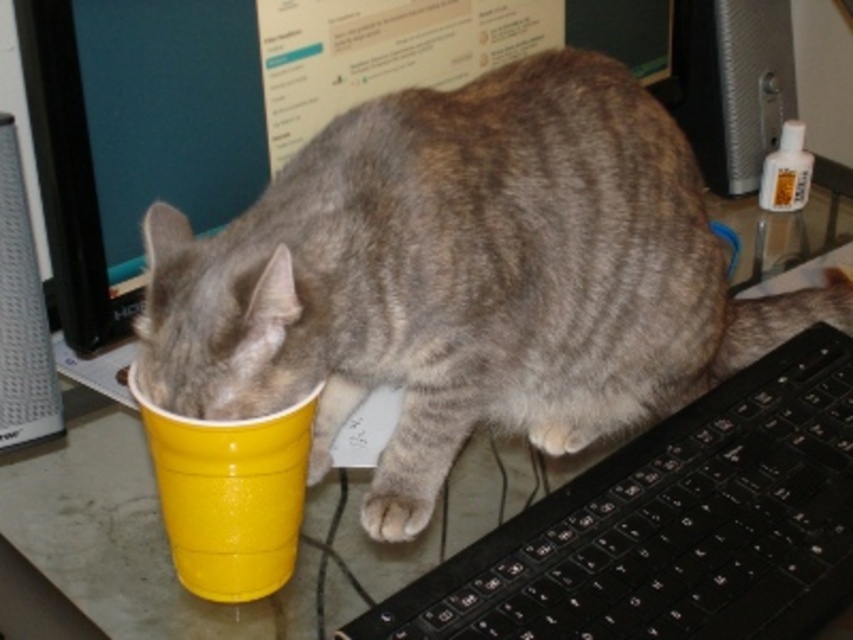
Is gray striped cat at center positioned at the back of black plastic keyboard at lower right?

No, it is not.

Identify the location of gray striped cat at center. Image resolution: width=853 pixels, height=640 pixels. (465, 273).

Is black plastic keyboard at lower right further to the viewer compared to yellow plastic cup at lower left?

Yes, black plastic keyboard at lower right is behind yellow plastic cup at lower left.

Who is more distant from viewer, [697,449] or [231,508]?

The point [697,449] is more distant.

Consider the image. Who is more distant from viewer, (695, 554) or (296, 484)?

Positioned behind is point (695, 554).

This screenshot has width=853, height=640. I want to click on black plastic keyboard at lower right, so click(x=672, y=525).

Based on the photo, does gray striped cat at center have a lesser height compared to white fur paw at lower center?

Incorrect, gray striped cat at center's height does not fall short of white fur paw at lower center's.

This screenshot has width=853, height=640. What do you see at coordinates (465, 273) in the screenshot?
I see `gray striped cat at center` at bounding box center [465, 273].

Does point (381, 102) come closer to viewer compared to point (393, 499)?

That is True.

Where is `gray striped cat at center`? The width and height of the screenshot is (853, 640). gray striped cat at center is located at coordinates (465, 273).